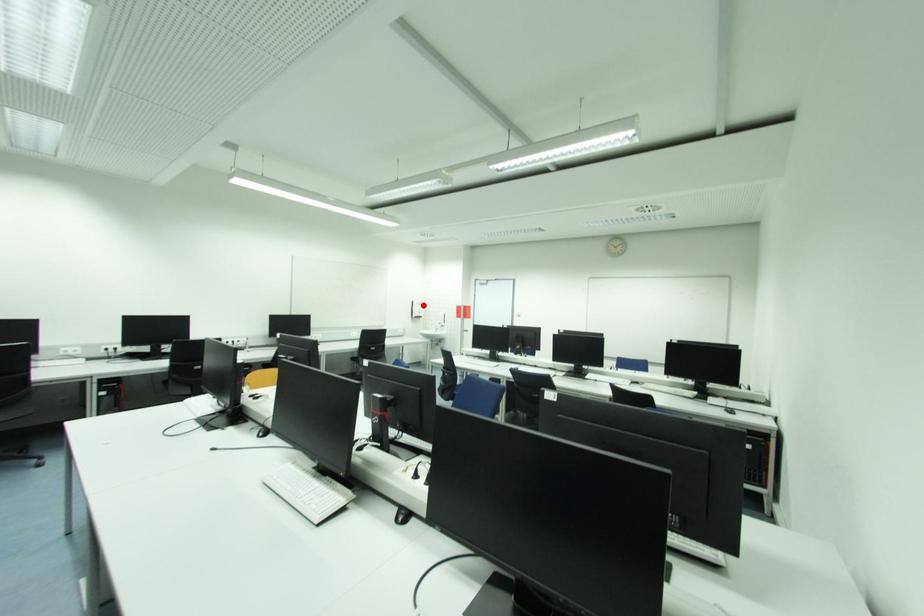
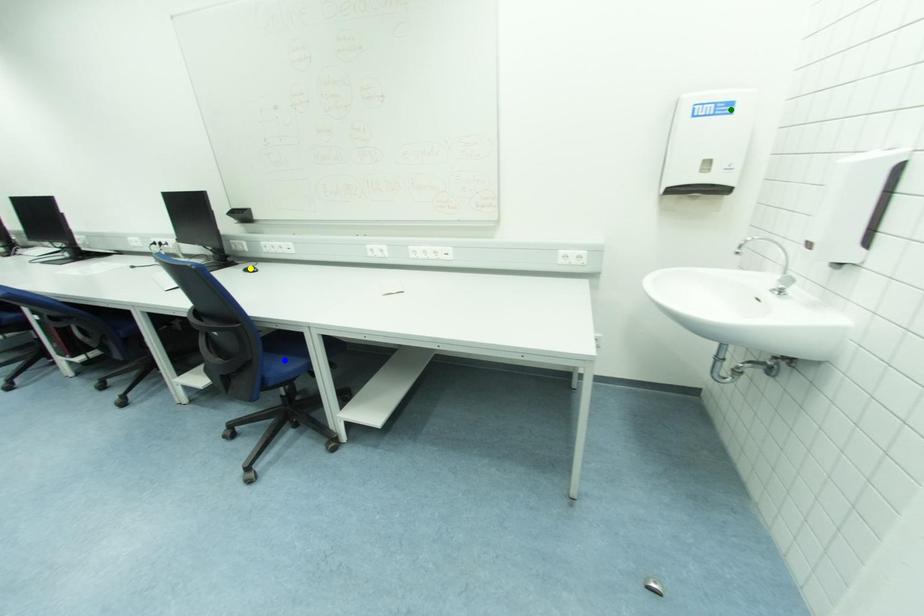
Question: I am providing you with two images of the same scene from different viewpoints. A red point is marked on the first image. You are given multiple points on the second image. Can you choose the point in image 2 that corresponds to the point in image 1?

Choices:
 (A) blue point
 (B) green point
 (C) yellow point

Answer: (B)